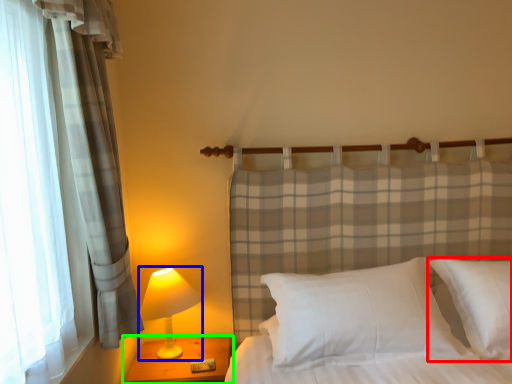
Question: Which is farther away from pillow (highlighted by a red box)? lamp (highlighted by a blue box) or nightstand (highlighted by a green box)?

Choices:
 (A) lamp
 (B) nightstand

Answer: (A)